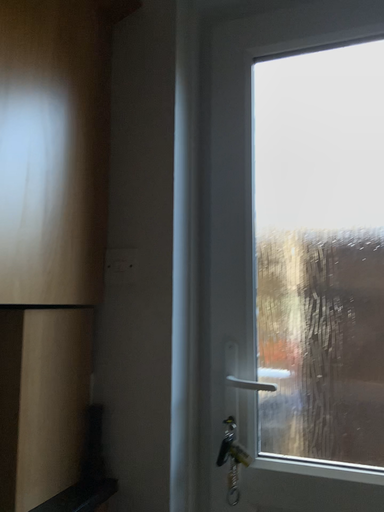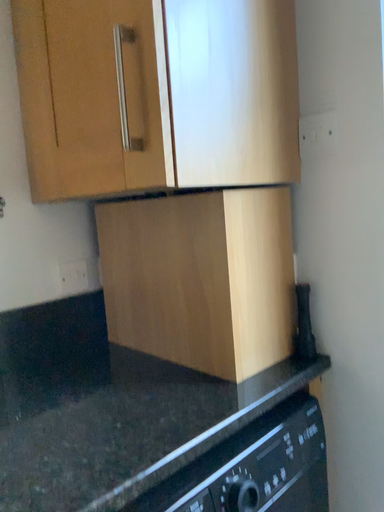
Question: Which way did the camera rotate in the video?

Choices:
 (A) rotated downward
 (B) rotated upward

Answer: (A)